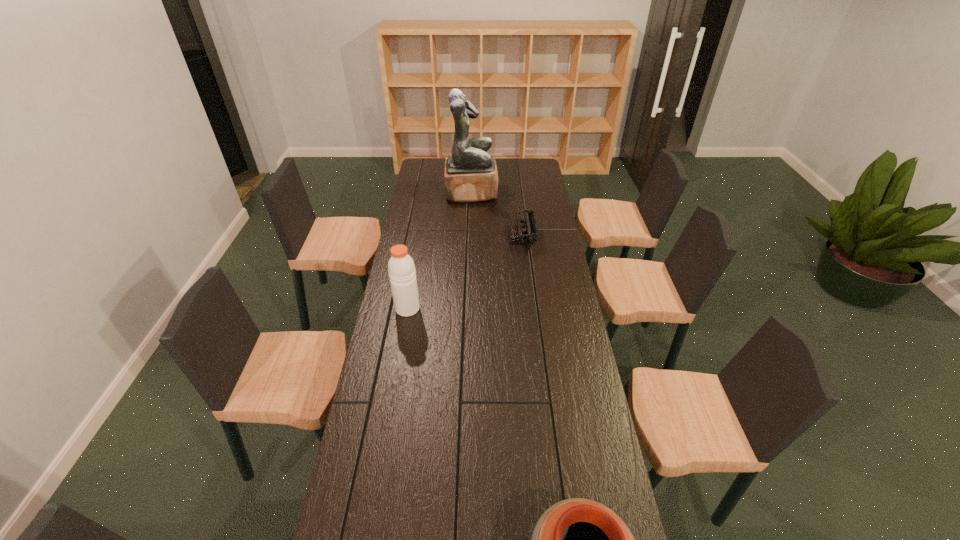
At what (x,y) coordinates should I click in order to perform the action: click on vacant space in between the third farthest object and the typewriter. Please return your answer as a coordinate pair (x, y). The image size is (960, 540). Looking at the image, I should click on (465, 273).

This screenshot has height=540, width=960. What are the coordinates of `unoccupied position between the farthest object and the shortest object` in the screenshot? It's located at (496, 214).

Identify the location of free point between the typewriter and the shaker. Image resolution: width=960 pixels, height=540 pixels. (465, 273).

Where is `vacant area that lies between the third shortest object and the second farthest object`? The height and width of the screenshot is (540, 960). vacant area that lies between the third shortest object and the second farthest object is located at coordinates (465, 273).

The height and width of the screenshot is (540, 960). In order to click on object that ranks as the third closest to the nearest object in this screenshot , I will do `click(470, 175)`.

Identify which object is the closest to the pottery. Please provide its 2D coordinates. Your answer should be formatted as a tuple, i.e. [(x, y)], where the tuple contains the x and y coordinates of a point satisfying the conditions above.

[(401, 267)]

Identify the location of blank area in the image that satisfies the following two spatial constraints: 1. in a relaxed pose on the second object from left to right; 2. on the front side of the third farthest object. The height and width of the screenshot is (540, 960). 468,308.

This screenshot has width=960, height=540. Find the location of `free location that satisfies the following two spatial constraints: 1. in a relaxed pose on the sculpture; 2. on the front side of the shaker`. free location that satisfies the following two spatial constraints: 1. in a relaxed pose on the sculpture; 2. on the front side of the shaker is located at coordinates (468, 308).